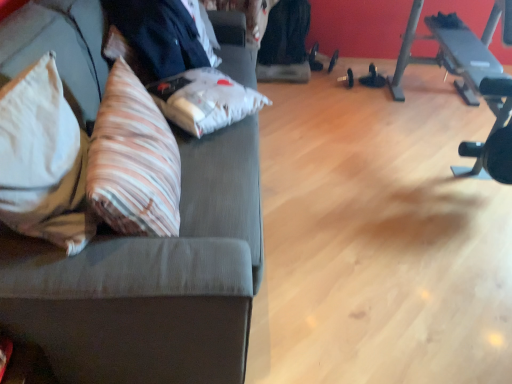
Question: In terms of width, does striped fabric throw pillow at left, which is counted as the first throw pillow, starting from the right, look wider or thinner when compared to textured gray couch at left?

Choices:
 (A) thin
 (B) wide

Answer: (A)

Question: Is striped fabric throw pillow at left, which appears as the second throw pillow when viewed from the left, in front of or behind textured gray couch at left in the image?

Choices:
 (A) behind
 (B) front

Answer: (A)

Question: Based on their relative distances, which object is nearer to the black rubber dumbbell at center?

Choices:
 (A) striped fabric throw pillow at left, which appears as the second throw pillow when viewed from the left
 (B) beige fabric pillow at left, marked as the 1th throw pillow in a left-to-right arrangement
 (C) striped fabric pillow at center
 (D) textured gray couch at left
 (E) black rubber barbell at right

Answer: (E)

Question: Considering the real-world distances, which object is closest to the textured gray couch at left?

Choices:
 (A) striped fabric pillow at center
 (B) striped fabric throw pillow at left, which is counted as the first throw pillow, starting from the right
 (C) black rubber barbell at right
 (D) black rubber dumbbell at center
 (E) black fabric businessman at upper left

Answer: (B)